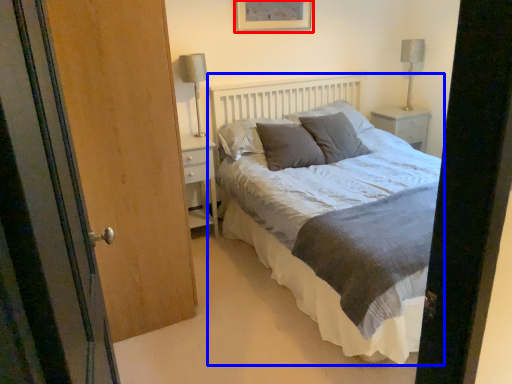
Question: Which point is closer to the camera, picture frame (highlighted by a red box) or bed (highlighted by a blue box)?

Choices:
 (A) picture frame
 (B) bed

Answer: (B)